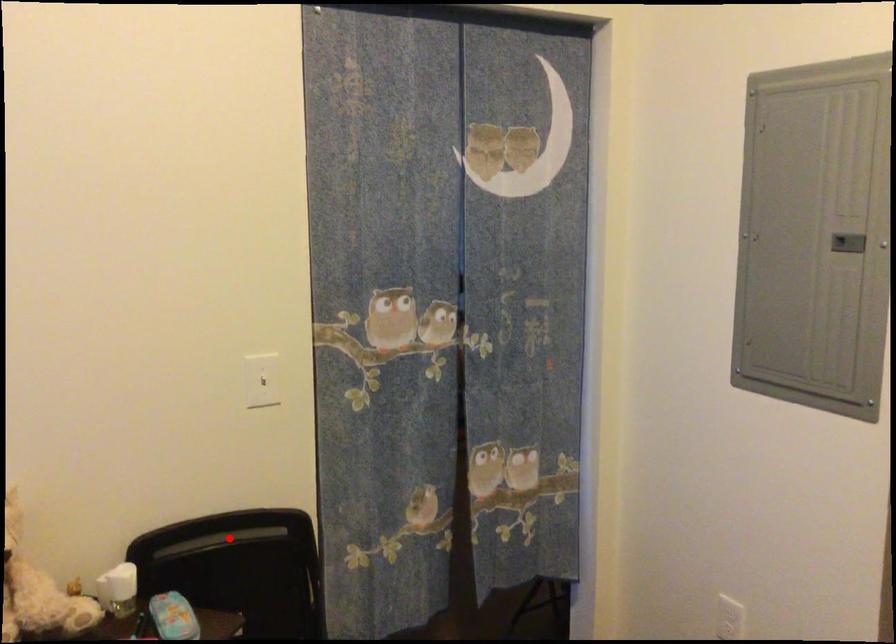
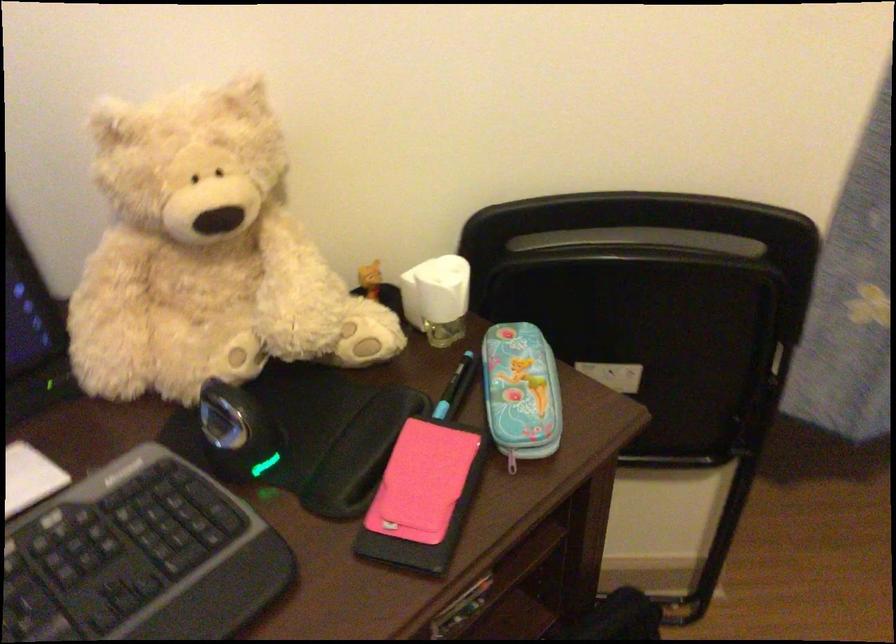
Locate, in the second image, the point that corresponds to the highlighted location in the first image.

(642, 240)